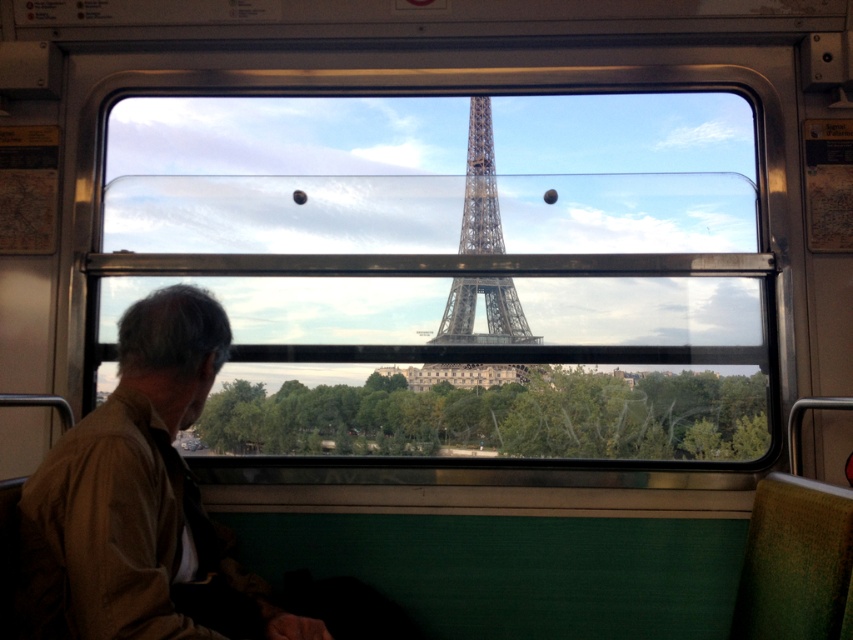
Question: Does brown cotton shirt at left appear under metallic gray eiffel tower at center?

Choices:
 (A) no
 (B) yes

Answer: (B)

Question: Which point appears closest to the camera in this image?

Choices:
 (A) (173, 426)
 (B) (511, 369)

Answer: (A)

Question: Can you confirm if brown cotton shirt at left is thinner than metallic gray eiffel tower at center?

Choices:
 (A) yes
 (B) no

Answer: (B)

Question: Does brown cotton shirt at left have a smaller size compared to metallic gray eiffel tower at center?

Choices:
 (A) no
 (B) yes

Answer: (A)

Question: Which object is closer to the camera taking this photo?

Choices:
 (A) brown cotton shirt at left
 (B) metallic gray eiffel tower at center

Answer: (A)

Question: Among these points, which one is nearest to the camera?

Choices:
 (A) (480, 157)
 (B) (186, 557)

Answer: (B)